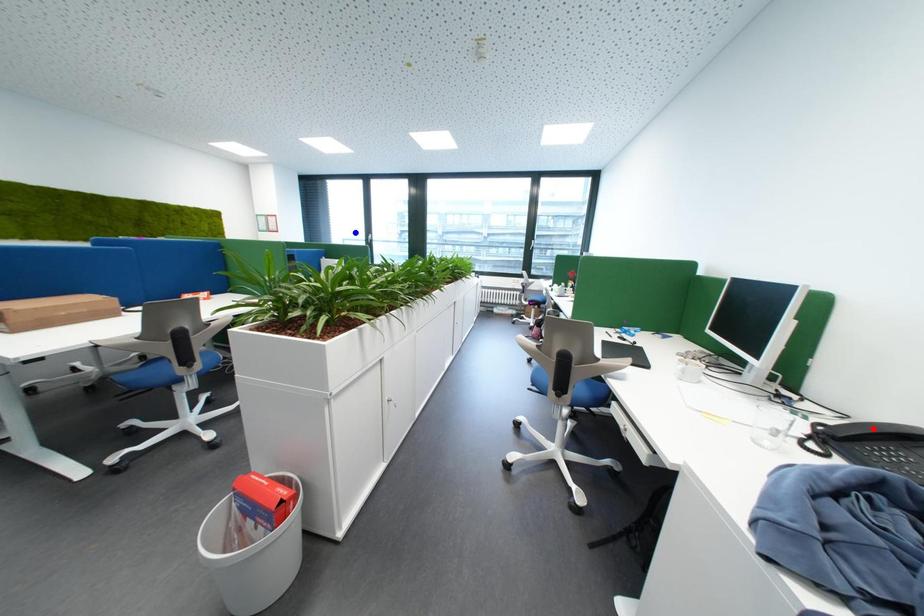
Question: Two points are marked on the image. Which point is closer to the camera?

Choices:
 (A) Blue point is closer.
 (B) Red point is closer.

Answer: (B)